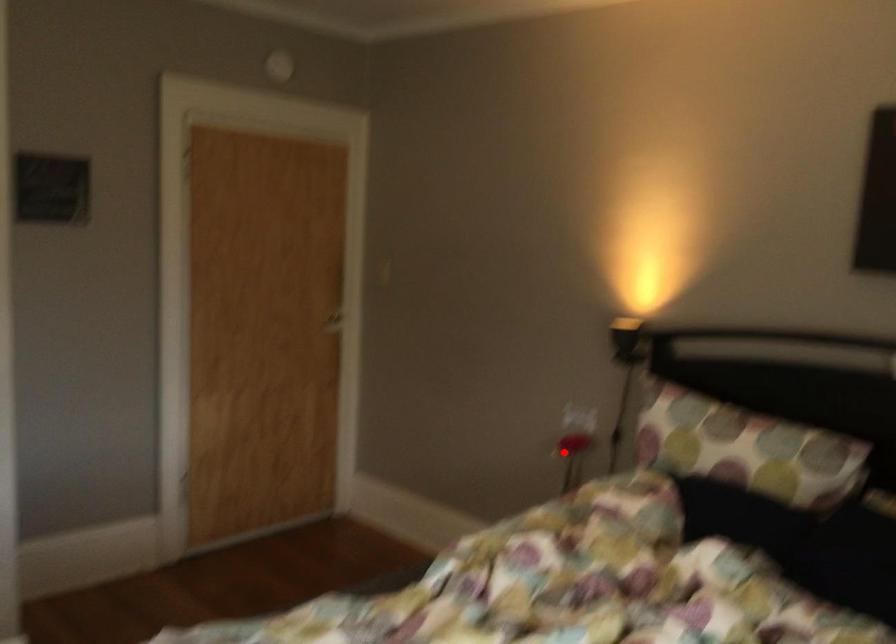
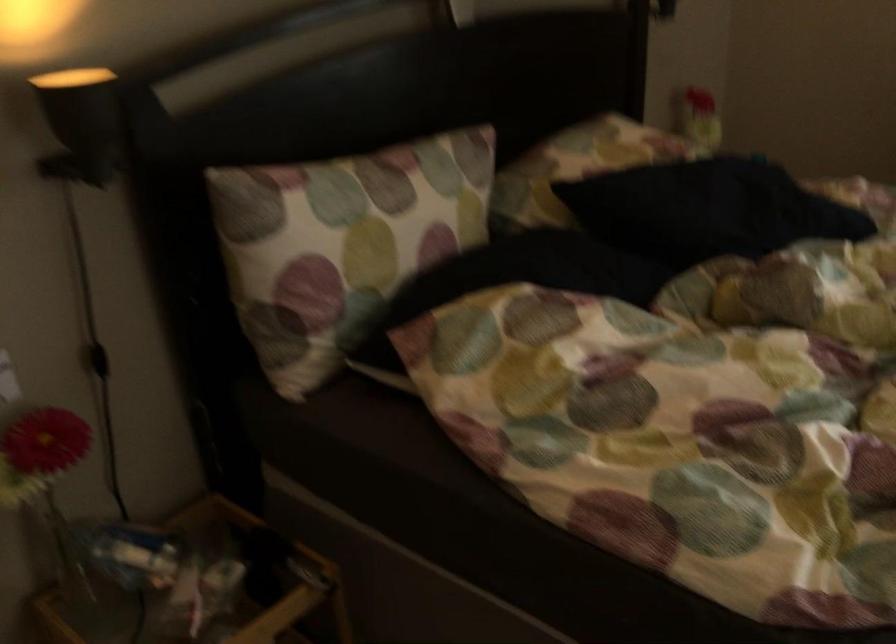
Question: A red point is marked in image1. In image2, is the corresponding 3D point closer to the camera or farther? Reply with the corresponding letter.

Choices:
 (A) The corresponding 3D point is closer.
 (B) The corresponding 3D point is farther.

Answer: (A)